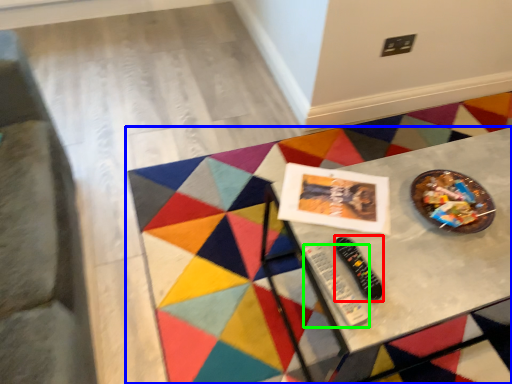
Question: Which object is the farthest from control (highlighted by a red box)? Choose among these: table (highlighted by a blue box) or control (highlighted by a green box).

Choices:
 (A) table
 (B) control

Answer: (A)